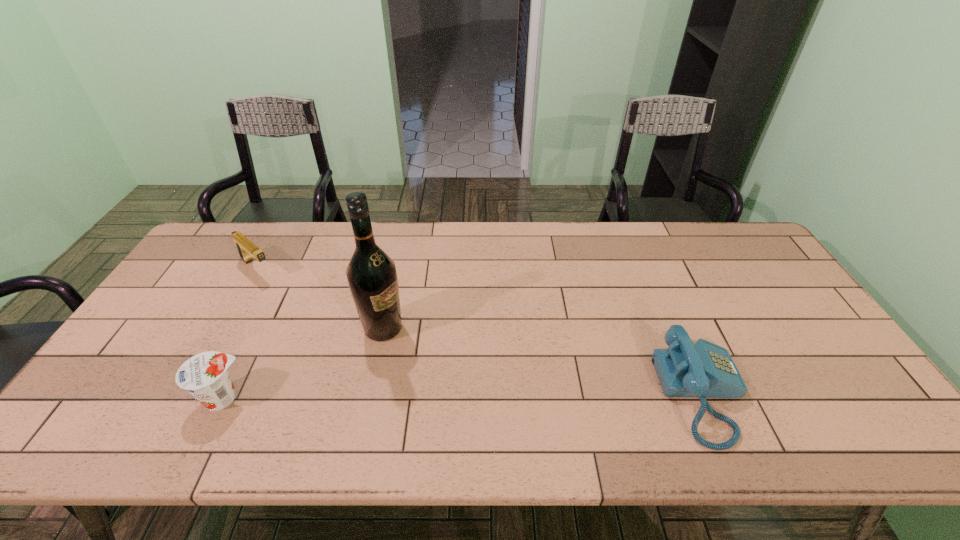
The width and height of the screenshot is (960, 540). Find the location of `yogurt`. yogurt is located at coordinates tap(205, 376).

Find the location of a particular element. The height and width of the screenshot is (540, 960). the rightmost object is located at coordinates (706, 370).

I want to click on wine bottle, so click(x=371, y=273).

Identify the location of the tallest object. Image resolution: width=960 pixels, height=540 pixels. (371, 273).

Where is `the farthest object`? the farthest object is located at coordinates (246, 249).

The image size is (960, 540). In order to click on blank area located on the right of the yogurt in this screenshot , I will do `click(334, 398)`.

Locate an element on the screen. free space located on the dial of the rightmost object is located at coordinates (767, 394).

Find the location of a particular element. The image size is (960, 540). free space located 0.080m on the label of the second farthest object is located at coordinates (424, 349).

You are a GUI agent. You are given a task and a screenshot of the screen. Output one action in this format:
    pyautogui.click(x=<x>, y=<y>)
    Task: Click on the vacant position located on the label of the second farthest object
    This screenshot has width=960, height=540.
    Given the screenshot: What is the action you would take?
    pyautogui.click(x=500, y=387)

Where is `vacant space located 0.300m on the label of the second farthest object`? The image size is (960, 540). vacant space located 0.300m on the label of the second farthest object is located at coordinates (496, 386).